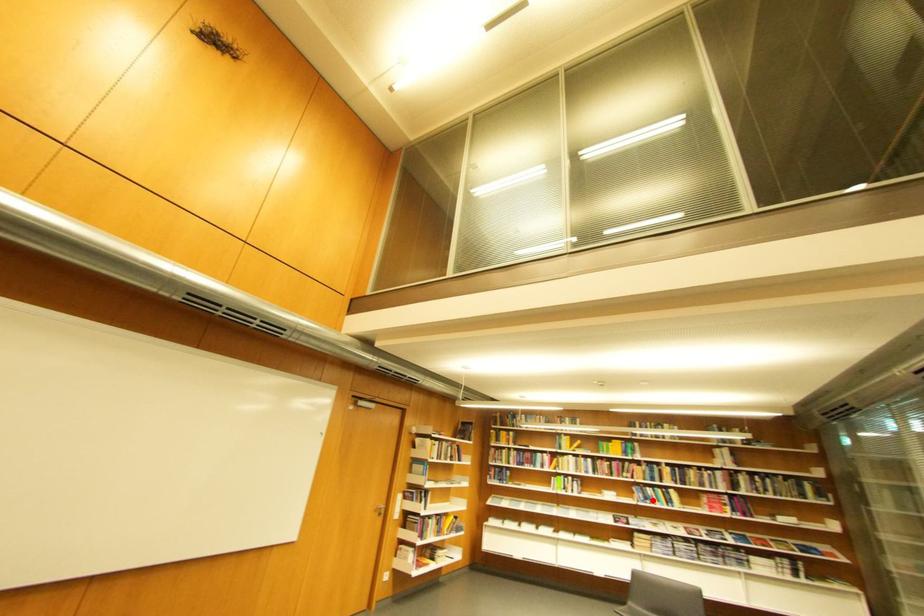
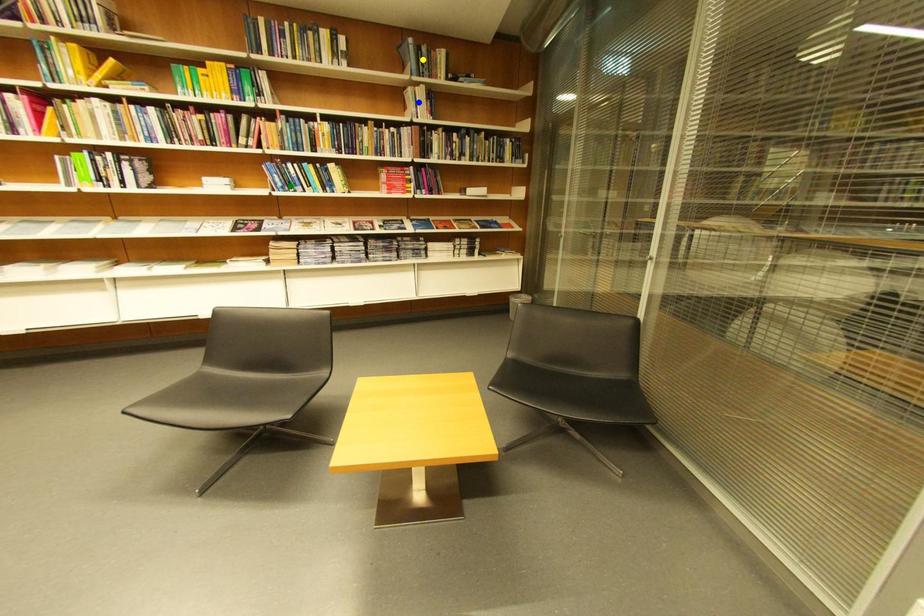
Question: I am providing you with two images of the same scene from different viewpoints. A red point is marked on the first image. You are given multiple points on the second image. Can you choose the point in image 2 that corresponds to the point in image 1?

Choices:
 (A) blue point
 (B) yellow point
 (C) green point

Answer: (C)